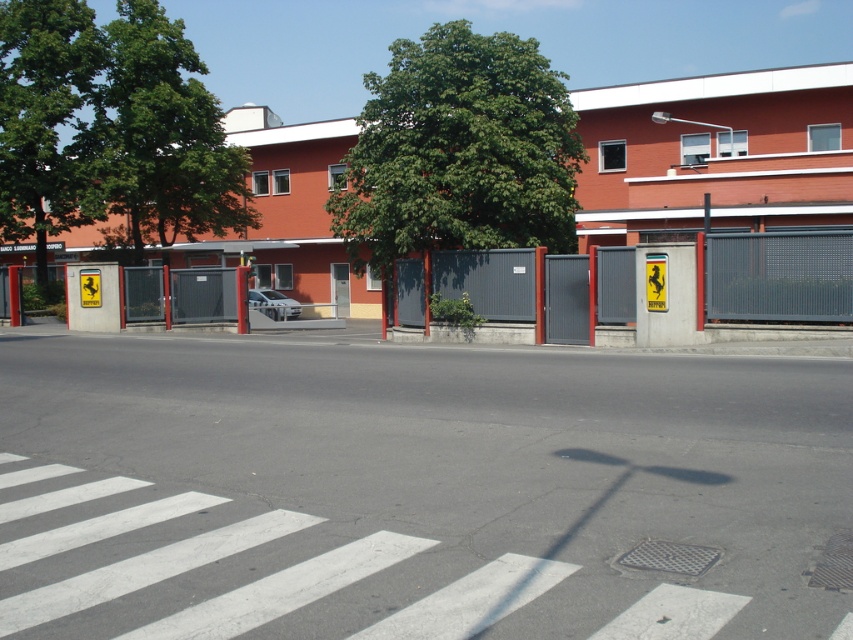
You are standing at the point with coordinates point (4, 76) and want to walk towards the point with coordinates point (276, 308). According to the scene, will you be moving away from or towards the building with the reddish brown facade?

Since point (4, 76) is in front of point (276, 308), you will be moving away from the building with the reddish brown facade as you walk towards point (276, 308).

You are a delivery person who needs to park your 5.5 meter long truck between the green leafy tree at upper left and the white glossy car at center. Can you fit your truck in that space?

The distance between the green leafy tree at upper left and the white glossy car at center is 11.73 meters. Since your truck is 5.5 meters long, there is enough space to park it between them.

Looking at this image, you are standing on the pedestrian crossing and want to walk towards the green leafy tree at center and the green leafy tree at upper left. Which tree will appear larger to you as you approach?

The green leafy tree at center will appear larger because it is closer to you than the green leafy tree at upper left.